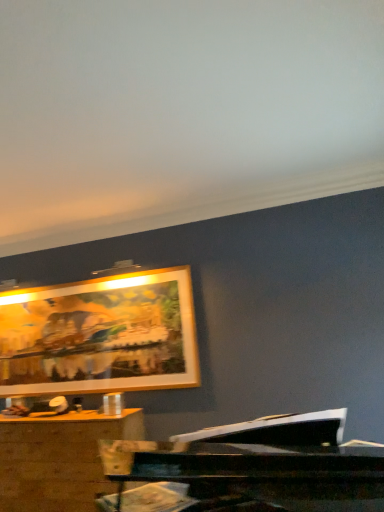
Question: Is point (54, 424) closer or farther from the camera than point (79, 307)?

Choices:
 (A) closer
 (B) farther

Answer: (A)

Question: From a real-world perspective, is wooden desk at lower left above or below gold-framed artwork at upper center?

Choices:
 (A) above
 (B) below

Answer: (B)

Question: Considering the positions of wooden desk at lower left and gold-framed artwork at upper center in the image, is wooden desk at lower left taller or shorter than gold-framed artwork at upper center?

Choices:
 (A) short
 (B) tall

Answer: (A)

Question: Is point (6, 307) positioned closer to the camera than point (39, 450)?

Choices:
 (A) farther
 (B) closer

Answer: (A)

Question: From a real-world perspective, relative to wooden desk at lower left, is gold-framed artwork at upper center vertically above or below?

Choices:
 (A) above
 (B) below

Answer: (A)

Question: Is gold-framed artwork at upper center inside or outside of wooden desk at lower left?

Choices:
 (A) outside
 (B) inside

Answer: (A)

Question: Is gold-framed artwork at upper center bigger or smaller than wooden desk at lower left?

Choices:
 (A) big
 (B) small

Answer: (B)